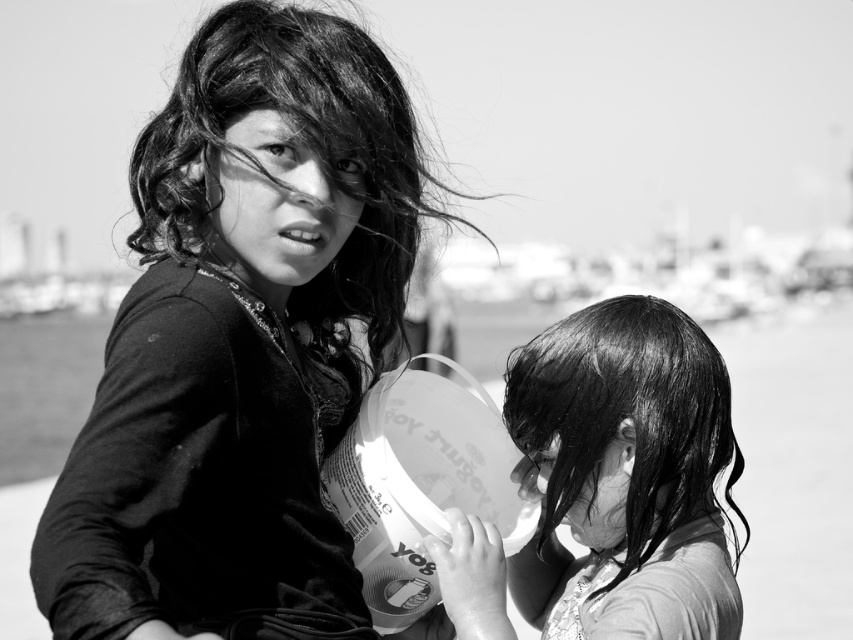
Is velvet black shirt at center bigger than wet hair at center?

Indeed, velvet black shirt at center has a larger size compared to wet hair at center.

Between point (345, 390) and point (527, 564), which one is positioned in front?

Point (527, 564) is in front.

Is point (291, 611) farther from viewer compared to point (482, 536)?

No.

The image size is (853, 640). What are the coordinates of `velvet black shirt at center` in the screenshot? It's located at (241, 340).